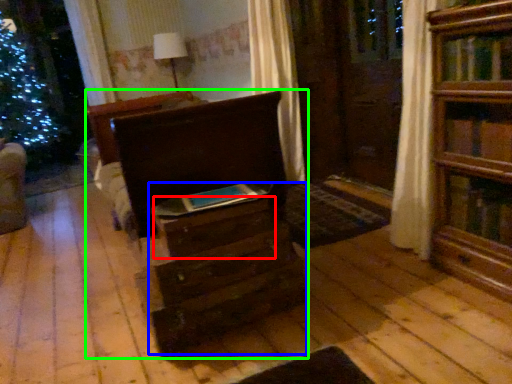
Question: Considering the real-world distances, which object is farthest from drawer (highlighted by a red box)? drawer (highlighted by a blue box) or chest of drawers (highlighted by a green box)?

Choices:
 (A) drawer
 (B) chest of drawers

Answer: (B)